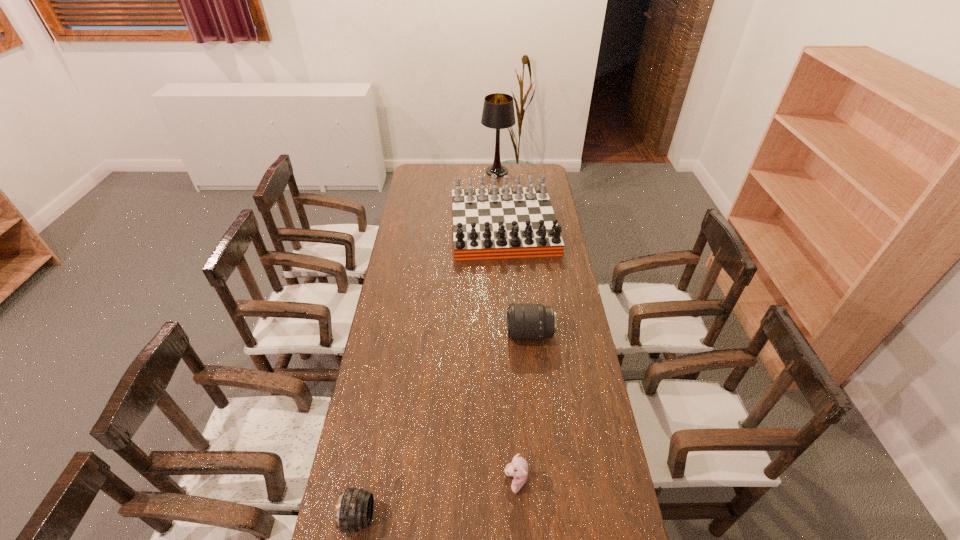
You are a GUI agent. You are given a task and a screenshot of the screen. Output one action in this format:
    pyautogui.click(x=<x>, y=<y>)
    Task: Click on the gameboard that is at the right edge
    This screenshot has width=960, height=540.
    Given the screenshot: What is the action you would take?
    pyautogui.click(x=505, y=222)

Locate an element on the screen. This screenshot has height=540, width=960. telephoto lens situated at the right edge is located at coordinates tap(525, 322).

Where is `vacant region at the far edge of the desktop`? vacant region at the far edge of the desktop is located at coordinates (516, 170).

Find the location of `free location at the left edge`. free location at the left edge is located at coordinates (415, 299).

You are a GUI agent. You are given a task and a screenshot of the screen. Output one action in this format:
    pyautogui.click(x=<x>, y=<y>)
    Task: Click on the vacant position at the right edge of the desktop
    
    Given the screenshot: What is the action you would take?
    pyautogui.click(x=571, y=300)

You are a GUI agent. You are given a task and a screenshot of the screen. Output one action in this format:
    pyautogui.click(x=<x>, y=<y>)
    Task: Click on the vacant space at the far left corner of the desktop
    Image resolution: width=960 pixels, height=540 pixels.
    Given the screenshot: What is the action you would take?
    click(x=433, y=178)

This screenshot has width=960, height=540. I want to click on free space at the far right corner of the desktop, so (524, 173).

Find the location of `free space that is in between the second nearest object and the third farthest object`. free space that is in between the second nearest object and the third farthest object is located at coordinates (523, 408).

The height and width of the screenshot is (540, 960). Find the location of `unoccupied area between the right telephoto lens and the second nearest object`. unoccupied area between the right telephoto lens and the second nearest object is located at coordinates pyautogui.click(x=523, y=408).

The image size is (960, 540). In order to click on vacant region between the fourth farthest object and the tallest object in this screenshot , I will do pyautogui.click(x=507, y=327).